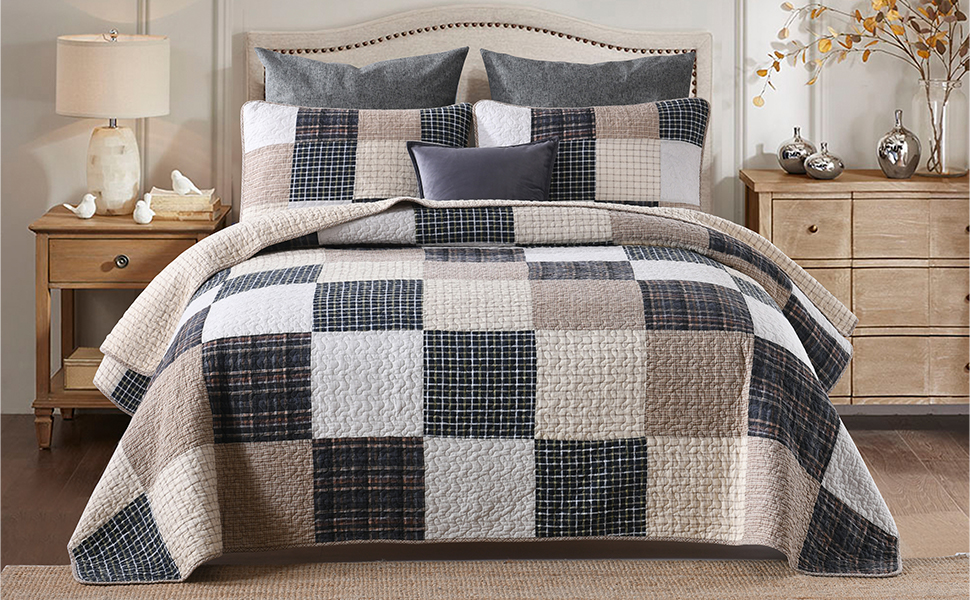
Locate an element on the screen. lampshade is located at coordinates (84, 78).